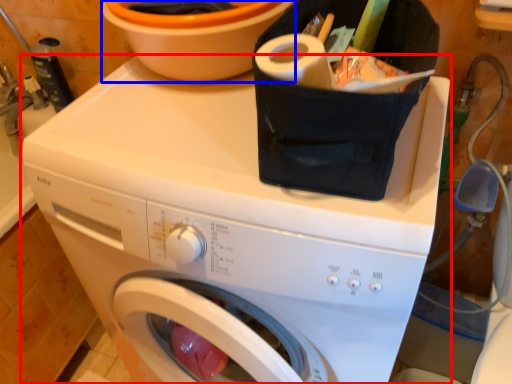
Question: Which object appears farthest to the camera in this image, washing machine (highlighted by a red box) or basin (highlighted by a blue box)?

Choices:
 (A) washing machine
 (B) basin

Answer: (B)